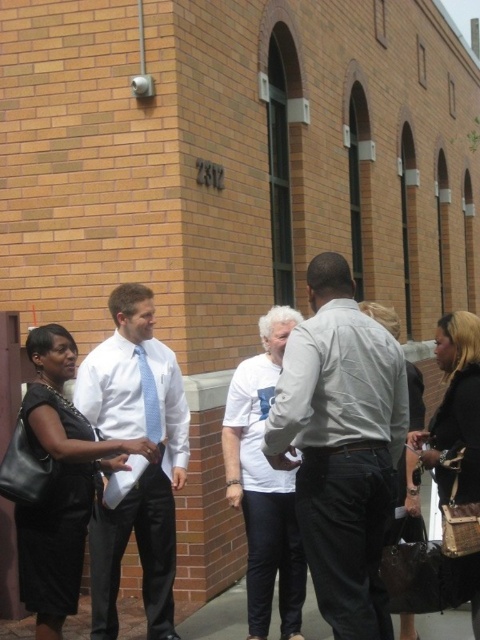
What is located at the coordinates point (60, 483) in the image?

The black leather dress at left is located at point (60, 483).

You are a photographer positioned at the entrance of the brick building. You need to capture a photo that includes both the black leather dress at left and the light blue woven tie at center. Based on their positions, which object should appear on the left side of the photo?

The black leather dress at left should appear on the left side of the photo because it is positioned to the left of the light blue woven tie at center.